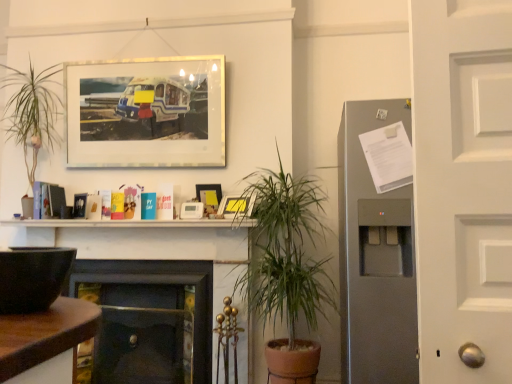
You are a GUI agent. You are given a task and a screenshot of the screen. Output one action in this format:
    pyautogui.click(x=<x>, y=<y>)
    Task: Click on the white matte books at center
    
    Given the screenshot: What is the action you would take?
    pyautogui.click(x=132, y=223)

This screenshot has height=384, width=512. Describe the element at coordinates (150, 319) in the screenshot. I see `dark wood fireplace at center, which ranks as the third fireplace in right-to-left order` at that location.

Describe the element at coordinates (146, 112) in the screenshot. I see `matte glass picture frame at upper center, the first picture frame in the top-to-bottom sequence` at that location.

Image resolution: width=512 pixels, height=384 pixels. What do you see at coordinates (142, 241) in the screenshot? I see `dark wood fireplace at center, the second fireplace viewed from the right` at bounding box center [142, 241].

How much space does dark wood fireplace at center, which is counted as the second fireplace, starting from the left, occupy vertically?

dark wood fireplace at center, which is counted as the second fireplace, starting from the left, is 37.82 inches tall.

Measure the distance between point (x=261, y=243) and camera.

The depth of point (x=261, y=243) is 7.89 feet.

I want to click on white matte books at center, so click(x=132, y=223).

Looking at this image, is matte glass picture frame at upper center, which ranks as the 3th picture frame in right-to-left order, further to camera compared to satin silver refrigerator at right, the third fireplace viewed from the left?

Yes, matte glass picture frame at upper center, which ranks as the 3th picture frame in right-to-left order, is further from the camera.

Who is taller, matte glass picture frame at upper center, the first picture frame in the top-to-bottom sequence, or satin silver refrigerator at right, the first fireplace when ordered from right to left?

satin silver refrigerator at right, the first fireplace when ordered from right to left, is taller.

Is matte glass picture frame at upper center, the first picture frame viewed from the left, facing towards satin silver refrigerator at right, the first fireplace when ordered from right to left?

No, matte glass picture frame at upper center, the first picture frame viewed from the left, is not facing towards satin silver refrigerator at right, the first fireplace when ordered from right to left.

How many degrees apart are the facing directions of matte glass picture frame at upper center, which ranks as the 3th picture frame in right-to-left order, and satin silver refrigerator at right, the third fireplace viewed from the left?

matte glass picture frame at upper center, which ranks as the 3th picture frame in right-to-left order, and satin silver refrigerator at right, the third fireplace viewed from the left, are facing 0.587 degrees away from each other.

In the image, is satin silver refrigerator at right, the first fireplace when ordered from right to left, positioned in front of or behind green leafy plant at center?

satin silver refrigerator at right, the first fireplace when ordered from right to left, is positioned farther from the viewer than green leafy plant at center.

Is green leafy plant at center surrounded by satin silver refrigerator at right, the first fireplace when ordered from right to left?

No.

From a real-world perspective, is satin silver refrigerator at right, the first fireplace when ordered from right to left, on top of green leafy plant at center?

Correct, in the physical world, satin silver refrigerator at right, the first fireplace when ordered from right to left, is higher than green leafy plant at center.

Is matte plastic picture frame at upper center, arranged as the 1th picture frame when viewed from the right, positioned behind dark wood fireplace at center, which ranks as the third fireplace in right-to-left order?

No, matte plastic picture frame at upper center, arranged as the 1th picture frame when viewed from the right, is closer to the camera.

Who is shorter, matte plastic picture frame at upper center, acting as the third picture frame starting from the left, or dark wood fireplace at center, which ranks as the first fireplace in left-to-right order?

matte plastic picture frame at upper center, acting as the third picture frame starting from the left, is shorter.

Consider the image. Could you tell me if matte plastic picture frame at upper center, acting as the third picture frame starting from the left, is facing dark wood fireplace at center, which ranks as the first fireplace in left-to-right order?

No.

From the image's perspective, who appears lower, matte plastic picture frame at upper center, the third picture frame positioned from the top, or dark wood fireplace at center, which ranks as the third fireplace in right-to-left order?

dark wood fireplace at center, which ranks as the third fireplace in right-to-left order, appears lower in the image.

From the image's perspective, would you say matte glass picture frame at upper center, the first picture frame viewed from the left, is positioned over matte black bowl at left?

Correct, matte glass picture frame at upper center, the first picture frame viewed from the left, appears higher than matte black bowl at left in the image.

Is matte black bowl at left at the back of matte glass picture frame at upper center, which ranks as the 3th picture frame in right-to-left order?

No, matte glass picture frame at upper center, which ranks as the 3th picture frame in right-to-left order,'s orientation is not away from matte black bowl at left.

In the scene shown: Considering the sizes of objects matte glass picture frame at upper center, which ranks as the 3th picture frame in right-to-left order, and matte black bowl at left in the image provided, who is bigger, matte glass picture frame at upper center, which ranks as the 3th picture frame in right-to-left order, or matte black bowl at left?

matte glass picture frame at upper center, which ranks as the 3th picture frame in right-to-left order.

Does matte glass picture frame at upper center, the 3th picture frame in the bottom-to-top sequence, come behind matte black bowl at left?

Yes, matte glass picture frame at upper center, the 3th picture frame in the bottom-to-top sequence, is further from the camera.

Consider the image. From the image's perspective, relative to matte glass picture frame at upper center, the 3th picture frame in the bottom-to-top sequence, is satin silver refrigerator at right, the third fireplace viewed from the left, above or below?

satin silver refrigerator at right, the third fireplace viewed from the left, is below matte glass picture frame at upper center, the 3th picture frame in the bottom-to-top sequence.

Is satin silver refrigerator at right, the first fireplace when ordered from right to left, positioned before matte glass picture frame at upper center, the first picture frame viewed from the left?

Yes, satin silver refrigerator at right, the first fireplace when ordered from right to left, is in front of matte glass picture frame at upper center, the first picture frame viewed from the left.

This screenshot has height=384, width=512. Find the location of `fireplace on the right of matte glass picture frame at upper center, which ranks as the 3th picture frame in right-to-left order`. fireplace on the right of matte glass picture frame at upper center, which ranks as the 3th picture frame in right-to-left order is located at coordinates (375, 257).

From a real-world perspective, which object stands above the other?

matte glass picture frame at upper center, which ranks as the 3th picture frame in right-to-left order.

From a real-world perspective, which object stands above the other?

matte black bowl at left is physically above.

From the image's perspective, count 1st fireplaces downward from the matte black bowl at left and point to it. Please provide its 2D coordinates.

[(375, 257)]

Is matte black bowl at left beside satin silver refrigerator at right, the first fireplace when ordered from right to left?

matte black bowl at left and satin silver refrigerator at right, the first fireplace when ordered from right to left, are clearly separated.

Does matte black bowl at left have a smaller size compared to satin silver refrigerator at right, the third fireplace viewed from the left?

Indeed, matte black bowl at left has a smaller size compared to satin silver refrigerator at right, the third fireplace viewed from the left.

Looking at this image, considering the relative sizes of matte wooden picture frame at center, placed as the 2th picture frame when sorted from left to right, and matte glass picture frame at upper center, which ranks as the 3th picture frame in right-to-left order, in the image provided, is matte wooden picture frame at center, placed as the 2th picture frame when sorted from left to right, shorter than matte glass picture frame at upper center, which ranks as the 3th picture frame in right-to-left order,?

Yes, matte wooden picture frame at center, placed as the 2th picture frame when sorted from left to right, is shorter than matte glass picture frame at upper center, which ranks as the 3th picture frame in right-to-left order.

Is matte wooden picture frame at center, marked as the 2th picture frame in a bottom-to-top arrangement, spatially inside matte glass picture frame at upper center, the first picture frame in the top-to-bottom sequence, or outside of it?

matte wooden picture frame at center, marked as the 2th picture frame in a bottom-to-top arrangement, is not inside matte glass picture frame at upper center, the first picture frame in the top-to-bottom sequence, it's outside.

From the image's perspective, is matte wooden picture frame at center, marked as the 2th picture frame in a bottom-to-top arrangement, positioned above or below matte glass picture frame at upper center, the first picture frame viewed from the left?

Based on their image positions, matte wooden picture frame at center, marked as the 2th picture frame in a bottom-to-top arrangement, is located beneath matte glass picture frame at upper center, the first picture frame viewed from the left.

From the image's perspective, which picture frame is the 3rd one above the satin silver refrigerator at right, the first fireplace when ordered from right to left? Please provide its 2D coordinates.

[(146, 112)]

In order to click on fireplace that is the 1st object located behind the green leafy plant at center in this screenshot , I will do `click(375, 257)`.

Based on their spatial positions, is matte plastic picture frame at upper center, the third picture frame positioned from the top, or dark wood fireplace at center, which ranks as the first fireplace in left-to-right order, further from white matte books at center?

Among the two, dark wood fireplace at center, which ranks as the first fireplace in left-to-right order, is located further to white matte books at center.

From the image, which object appears to be farther from matte glass picture frame at upper center, which ranks as the 3th picture frame in right-to-left order, white matte books at center or matte plastic picture frame at upper center, arranged as the 1th picture frame when viewed from the right?

Among the two, matte plastic picture frame at upper center, arranged as the 1th picture frame when viewed from the right, is located further to matte glass picture frame at upper center, which ranks as the 3th picture frame in right-to-left order.

Estimate the real-world distances between objects in this image. Which object is closer to matte glass picture frame at upper center, the first picture frame in the top-to-bottom sequence, dark wood fireplace at center, which ranks as the first fireplace in left-to-right order, or dark wood fireplace at center, which is counted as the second fireplace, starting from the left?

Based on the image, dark wood fireplace at center, which is counted as the second fireplace, starting from the left, appears to be nearer to matte glass picture frame at upper center, the first picture frame in the top-to-bottom sequence.

From the image, which object appears to be farther from satin silver refrigerator at right, the third fireplace viewed from the left, matte wooden picture frame at center, the second picture frame from the right, or green leafy plant at center?

matte wooden picture frame at center, the second picture frame from the right.

Based on the photo, looking at the image, which one is located further to dark wood fireplace at center, which ranks as the first fireplace in left-to-right order, dark wood fireplace at center, which is counted as the second fireplace, starting from the left, or white matte books at center?

white matte books at center lies further to dark wood fireplace at center, which ranks as the first fireplace in left-to-right order, than the other object.

In the scene shown: Which object lies nearer to the anchor point dark wood fireplace at center, which ranks as the third fireplace in right-to-left order, matte wooden picture frame at center, marked as the 2th picture frame in a bottom-to-top arrangement, or matte glass picture frame at upper center, which ranks as the 3th picture frame in right-to-left order?

Among the two, matte wooden picture frame at center, marked as the 2th picture frame in a bottom-to-top arrangement, is located nearer to dark wood fireplace at center, which ranks as the third fireplace in right-to-left order.

Based on their spatial positions, is dark wood fireplace at center, the second fireplace viewed from the right, or matte glass picture frame at upper center, the first picture frame in the top-to-bottom sequence, closer to matte wooden picture frame at center, the second picture frame from the right?

Among the two, dark wood fireplace at center, the second fireplace viewed from the right, is located nearer to matte wooden picture frame at center, the second picture frame from the right.

Looking at the image, which one is located further to green leafy plant at center, matte wooden picture frame at center, placed as the 2th picture frame when sorted from left to right, or dark wood fireplace at center, the second fireplace viewed from the right?

matte wooden picture frame at center, placed as the 2th picture frame when sorted from left to right.

This screenshot has height=384, width=512. I want to click on appliance situated between white matte books at center and satin silver refrigerator at right, the first fireplace when ordered from right to left, from left to right, so (x=32, y=277).

The height and width of the screenshot is (384, 512). In order to click on houseplant between matte wooden picture frame at center, the second picture frame from the right, and satin silver refrigerator at right, the first fireplace when ordered from right to left in this screenshot , I will do `click(285, 251)`.

Where is `houseplant between matte glass picture frame at upper center, the first picture frame viewed from the left, and dark wood fireplace at center, which is counted as the second fireplace, starting from the left, in the vertical direction`? The width and height of the screenshot is (512, 384). houseplant between matte glass picture frame at upper center, the first picture frame viewed from the left, and dark wood fireplace at center, which is counted as the second fireplace, starting from the left, in the vertical direction is located at coordinates (285, 251).

You are a GUI agent. You are given a task and a screenshot of the screen. Output one action in this format:
    pyautogui.click(x=<x>, y=<y>)
    Task: Click on the mantle between matte glass picture frame at upper center, the 3th picture frame in the bottom-to-top sequence, and dark wood fireplace at center, the second fireplace viewed from the right, vertically
    Image resolution: width=512 pixels, height=384 pixels.
    Given the screenshot: What is the action you would take?
    pyautogui.click(x=132, y=223)